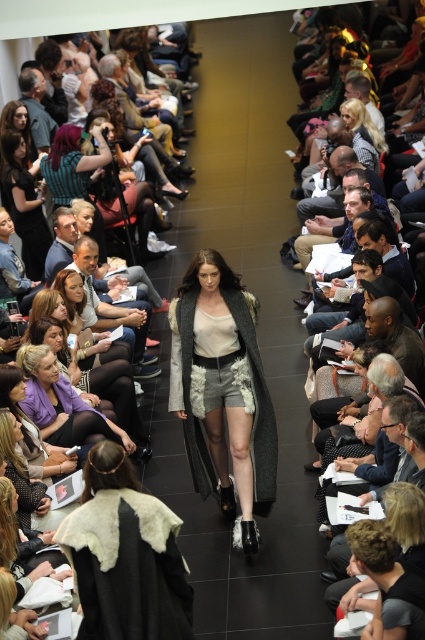
Consider the image. Please describe the clothing item located at the coordinates point (223, 392) in the image.

The point (223, 392) indicates gray textured coat at center.